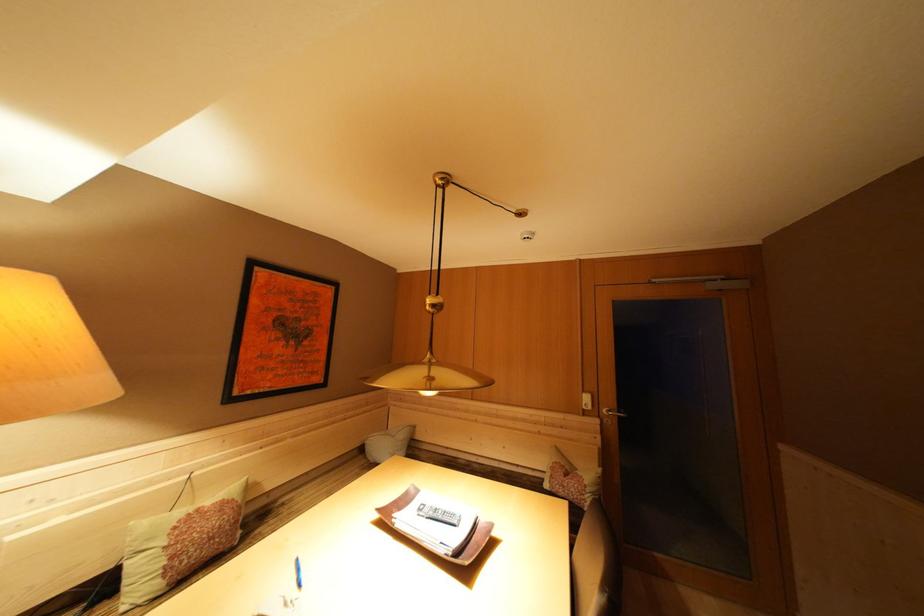
The height and width of the screenshot is (616, 924). What do you see at coordinates (612, 414) in the screenshot?
I see `the silver door handle` at bounding box center [612, 414].